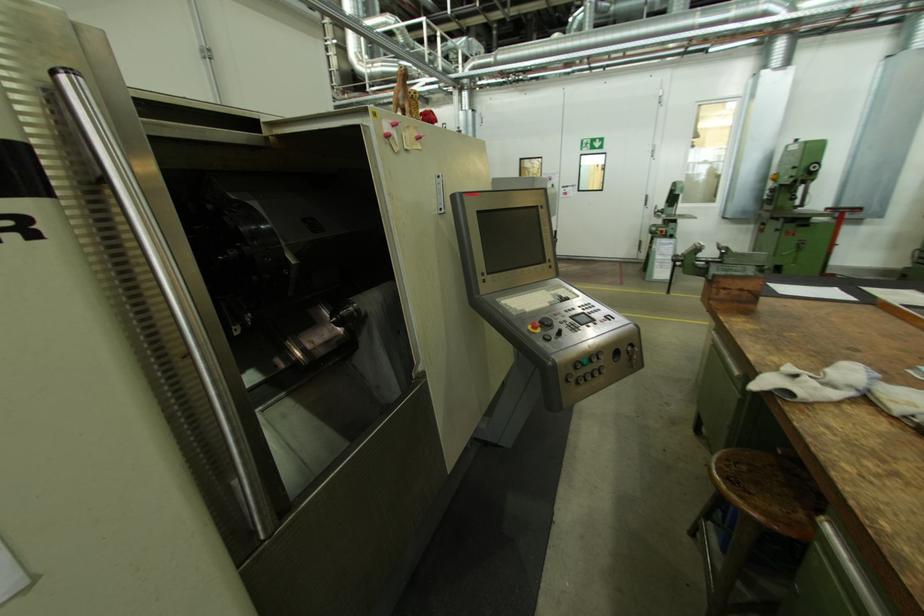
What do you see at coordinates (634, 355) in the screenshot? I see `the control panel lock` at bounding box center [634, 355].